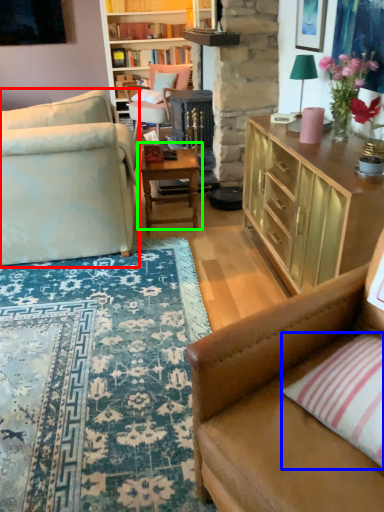
Question: Estimate the real-world distances between objects in this image. Which object is farther from studio couch (highlighted by a red box), pillow (highlighted by a blue box) or table (highlighted by a green box)?

Choices:
 (A) pillow
 (B) table

Answer: (A)